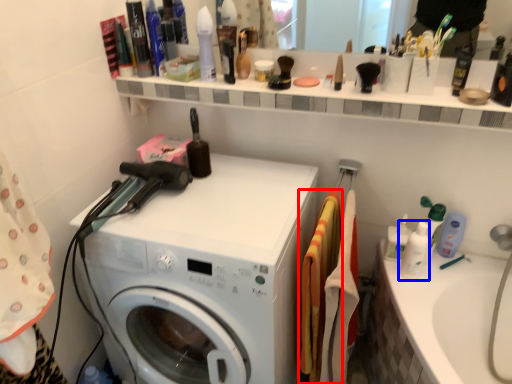
Question: Which point is closer to the camera, material (highlighted by a red box) or toiletry (highlighted by a blue box)?

Choices:
 (A) material
 (B) toiletry

Answer: (A)